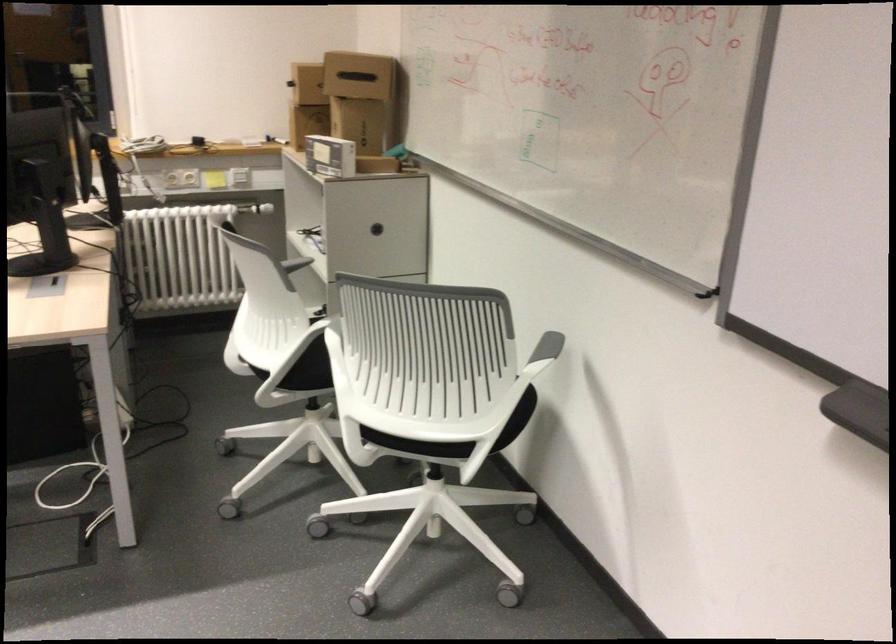
Find the location of a particular element. box handle slot is located at coordinates (357, 76).